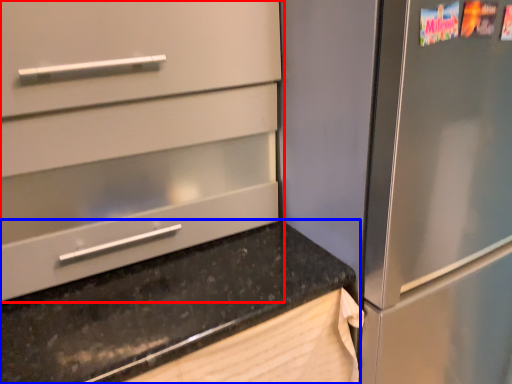
Question: Which object appears farthest to the camera in this image, cabinetry (highlighted by a red box) or countertop (highlighted by a blue box)?

Choices:
 (A) cabinetry
 (B) countertop

Answer: (A)